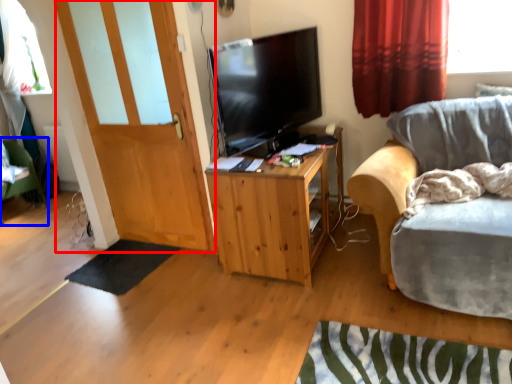
Question: Which object is further to the camera taking this photo, door (highlighted by a red box) or desk (highlighted by a blue box)?

Choices:
 (A) door
 (B) desk

Answer: (B)